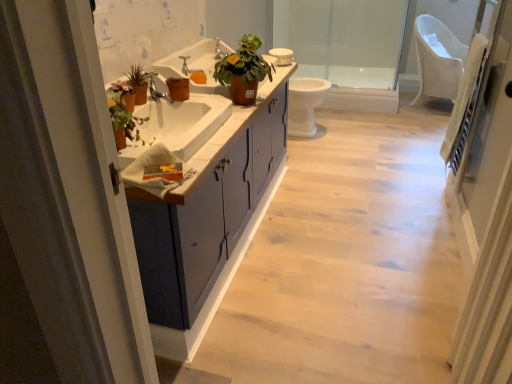
This screenshot has width=512, height=384. I want to click on spots to the right of white glossy toilet at center, so click(353, 132).